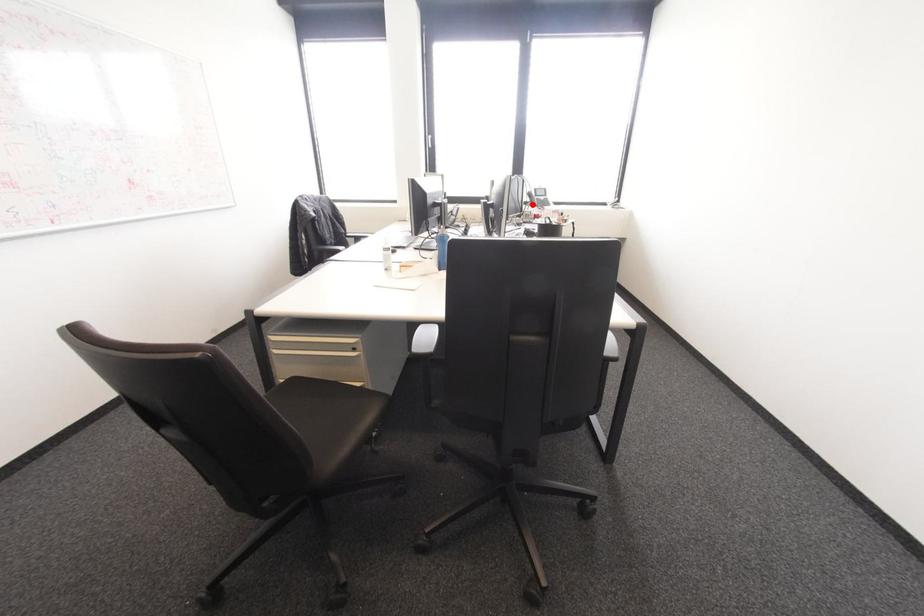
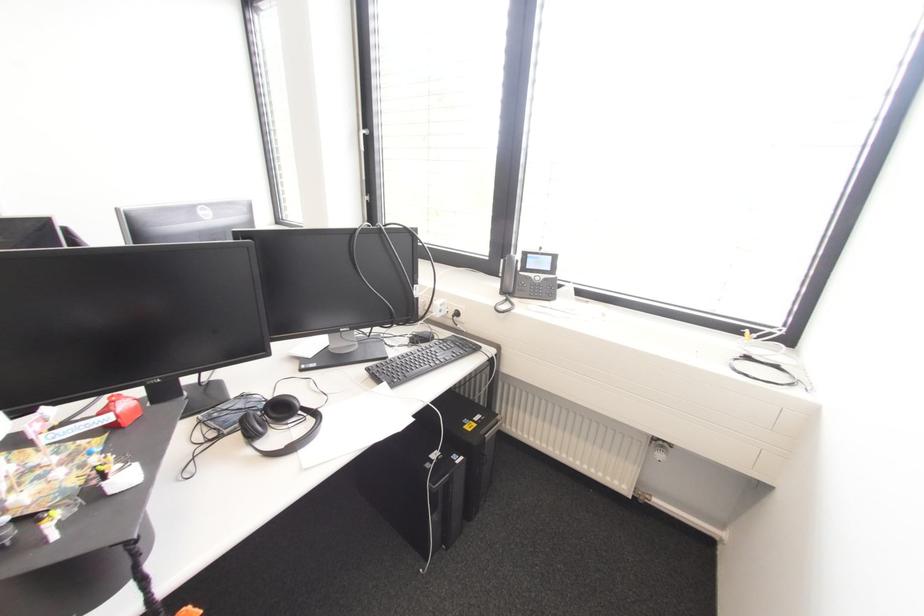
Find the pixel in the second image that matches the highlighted location in the first image.

(503, 292)